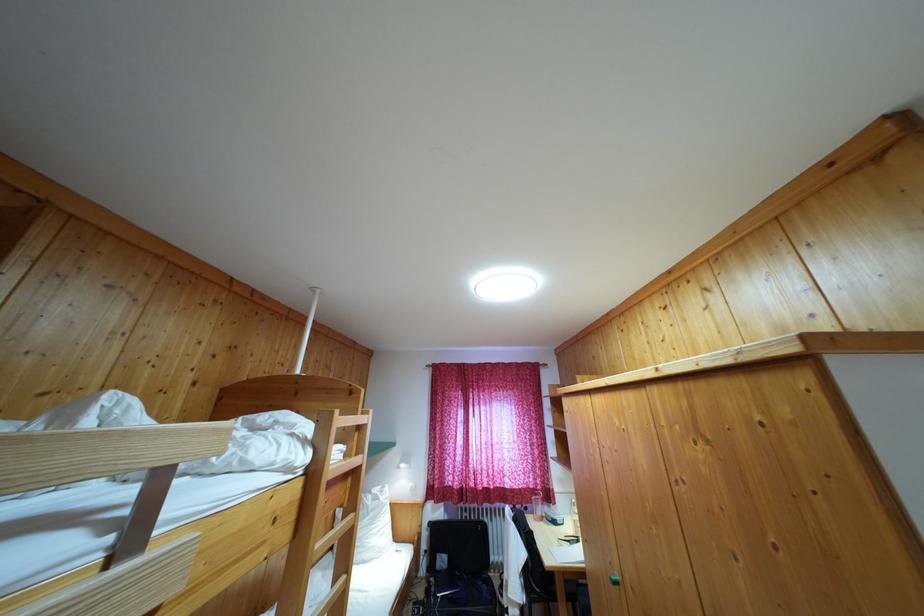
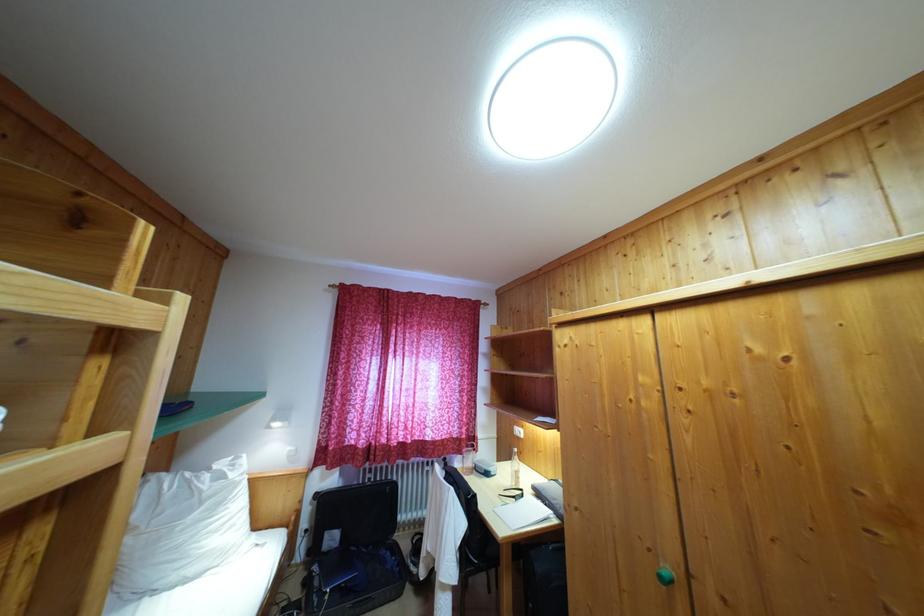
Question: In a continuous first-person perspective shot, in which direction is the camera moving?

Choices:
 (A) Left
 (B) Right
 (C) Forward
 (D) Backward

Answer: (C)